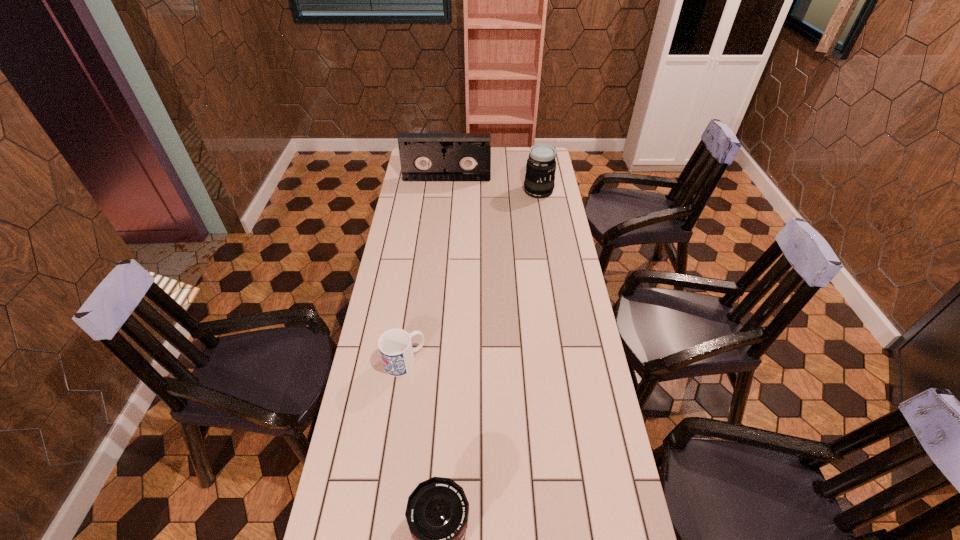
This screenshot has width=960, height=540. Find the location of `object located in the right edge section of the desktop`. object located in the right edge section of the desktop is located at coordinates (539, 181).

Identify the location of free space at the far edge of the desktop. (509, 156).

I want to click on free spot at the left edge of the desktop, so click(x=421, y=201).

What are the coordinates of `vacant area at the right edge` in the screenshot? It's located at (539, 232).

The image size is (960, 540). Find the location of `empty location between the second farthest object and the shortest object`. empty location between the second farthest object and the shortest object is located at coordinates (471, 276).

Image resolution: width=960 pixels, height=540 pixels. I want to click on object that can be found as the third closest to the farther telephoto lens, so click(437, 511).

What are the coordinates of `object that can be found as the third closest to the farther telephoto lens` in the screenshot? It's located at (437, 511).

Find the location of a particular element. The height and width of the screenshot is (540, 960). vacant area that satisfies the following two spatial constraints: 1. on the front side of the farthest object; 2. on the left side of the second farthest object is located at coordinates (445, 191).